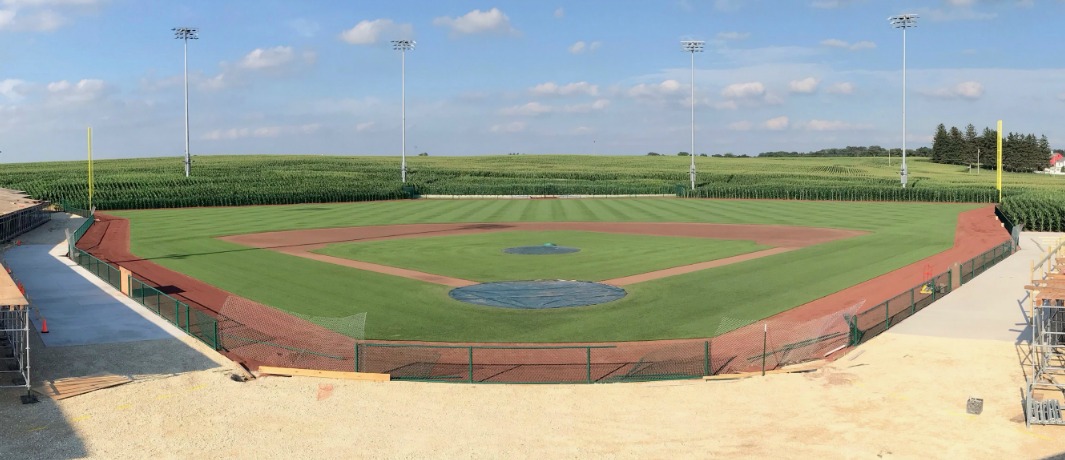
Identify the location of lights. This screenshot has height=460, width=1065. point(191,35), point(403,44), point(693,46), point(901,19).